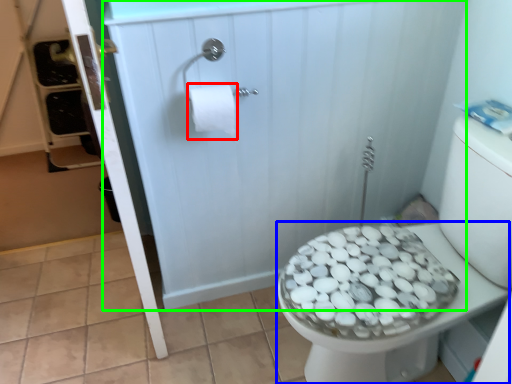
Question: Based on their relative distances, which object is farther from toilet paper (highlighted by a red box)? Choose from bidet (highlighted by a blue box) and screen door (highlighted by a green box).

Choices:
 (A) bidet
 (B) screen door

Answer: (A)